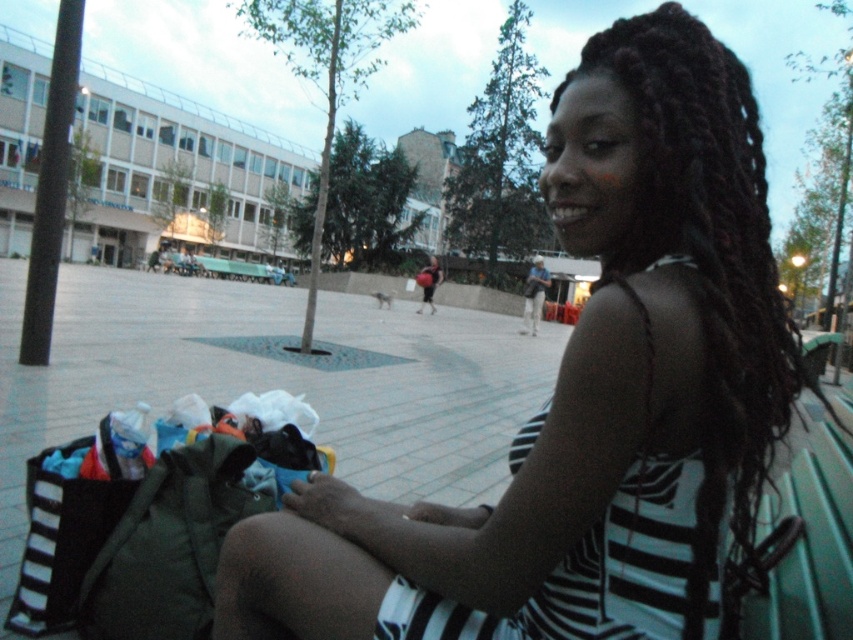
Can you confirm if black striped dress at center is positioned above black curly hair at upper right?

No, black striped dress at center is not above black curly hair at upper right.

Describe the element at coordinates (585, 396) in the screenshot. I see `black striped dress at center` at that location.

At what (x,y) coordinates should I click in order to perform the action: click on black striped dress at center. Please return your answer as a coordinate pair (x, y). The image size is (853, 640). Looking at the image, I should click on (585, 396).

Which is behind, point (688, 33) or point (421, 628)?

The point (688, 33) is behind.

Which is more to the left, black curly hair at upper right or black striped dress at right?

black striped dress at right is more to the left.

Which is in front, point (740, 120) or point (720, 513)?

Point (720, 513)

Find the location of a particular element. The width and height of the screenshot is (853, 640). black curly hair at upper right is located at coordinates (711, 275).

Is black striped dress at center shorter than black striped dress at right?

No.

Who is more distant from viewer, (x=640, y=404) or (x=553, y=600)?

Positioned behind is point (x=553, y=600).

The width and height of the screenshot is (853, 640). I want to click on black striped dress at center, so click(585, 396).